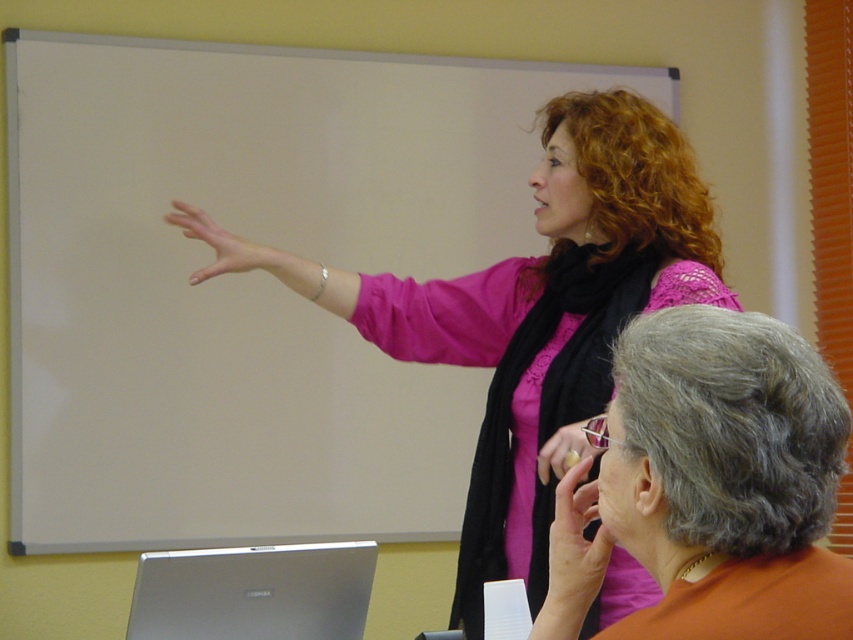
Looking at this image, does smooth skin hand at upper right appear on the right side of matte pink hand at upper center?

Correct, you'll find smooth skin hand at upper right to the right of matte pink hand at upper center.

I want to click on smooth skin hand at upper right, so click(x=575, y=545).

Between point (355, 576) and point (550, 550), which one is positioned in front?

Point (550, 550) is in front.

Who is positioned more to the left, silver metallic laptop at lower left or smooth skin hand at upper right?

silver metallic laptop at lower left

Does point (236, 632) come in front of point (567, 547)?

No, (236, 632) is further to viewer.

Where is `silver metallic laptop at lower left`? Image resolution: width=853 pixels, height=640 pixels. silver metallic laptop at lower left is located at coordinates (253, 593).

Is pink matte/black scarf at upper center to the left of matte pink blouse at center from the viewer's perspective?

Correct, you'll find pink matte/black scarf at upper center to the left of matte pink blouse at center.

Does point (457, 352) come closer to viewer compared to point (724, 600)?

No, it is behind (724, 600).

Does point (492, 291) come farther from viewer compared to point (546, 605)?

Yes, it is behind point (546, 605).

Find the location of a particular element. pink matte/black scarf at upper center is located at coordinates (546, 314).